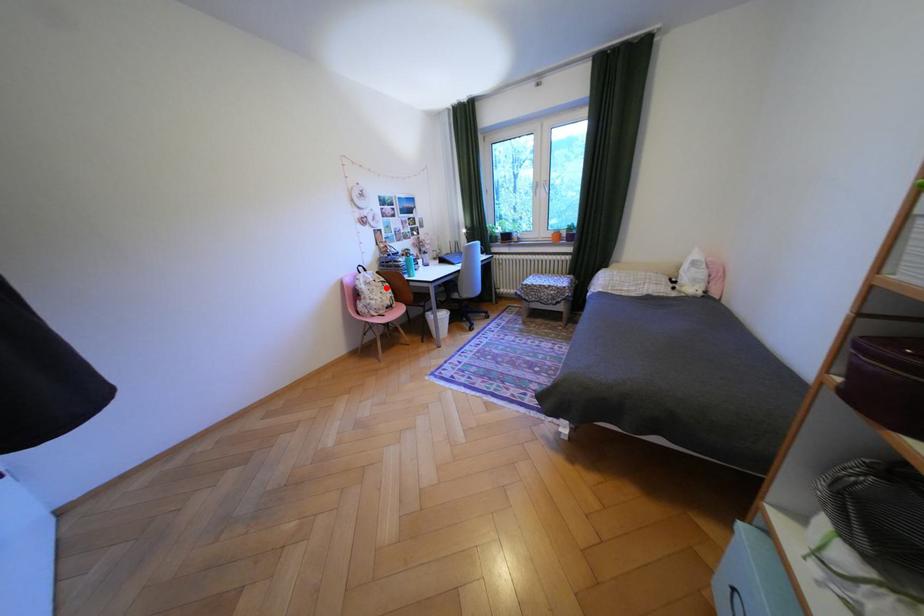
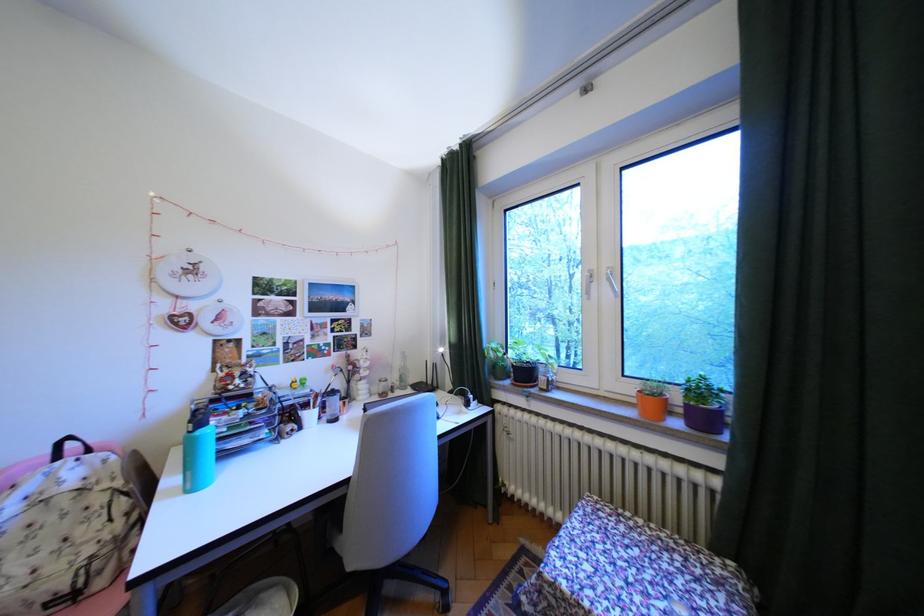
Locate, in the second image, the point that corresponds to the highlighted location in the first image.

(65, 519)